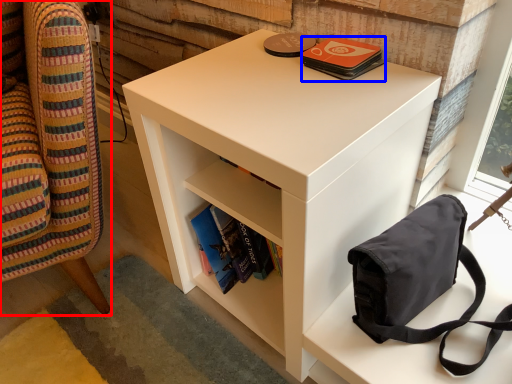
Question: Which point is further to the camera, furniture (highlighted by a red box) or paperback book (highlighted by a blue box)?

Choices:
 (A) furniture
 (B) paperback book

Answer: (B)